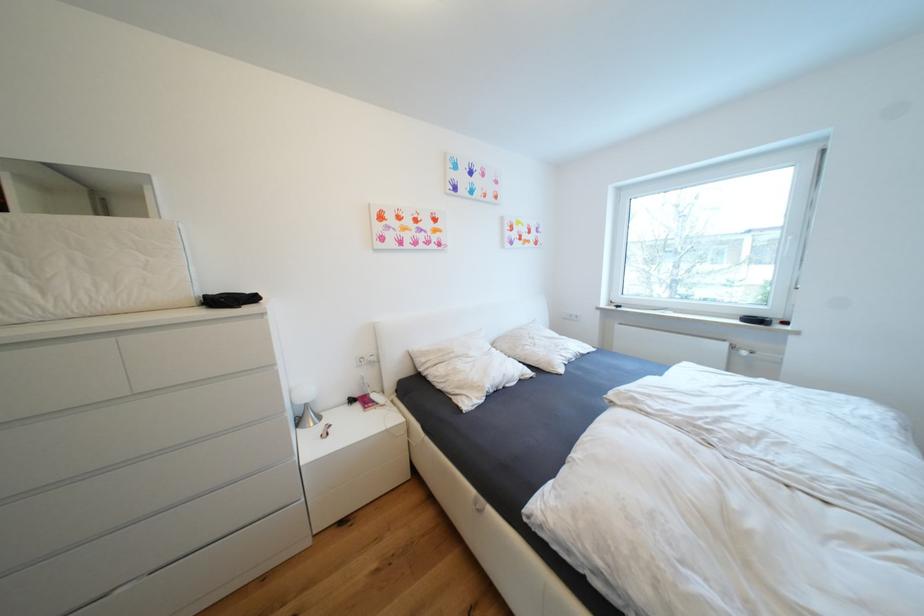
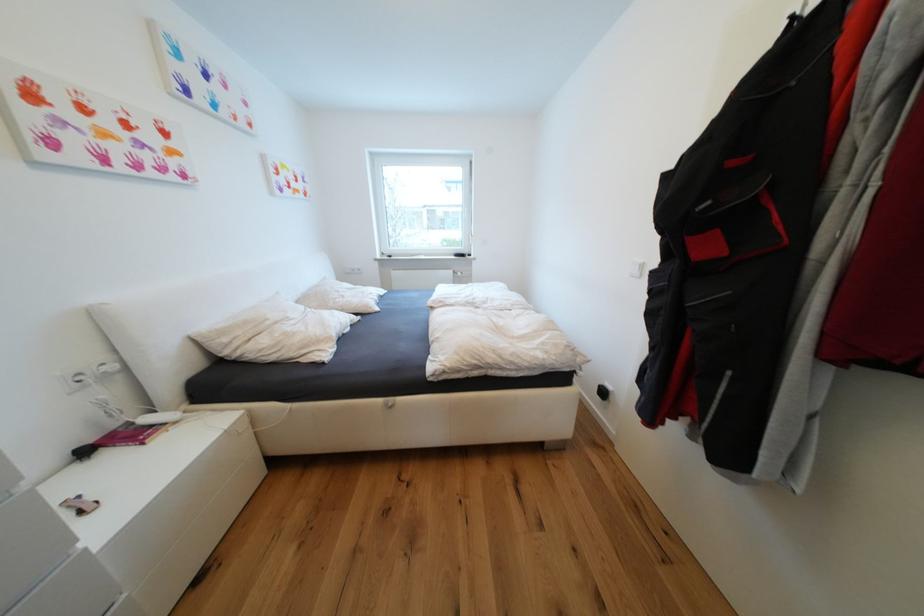
Question: The camera is either moving clockwise (left) or counter-clockwise (right) around the object. The first image is from the beginning of the video and the second image is from the end. Is the camera moving left or right when shooting the video?

Choices:
 (A) Left
 (B) Right

Answer: (A)